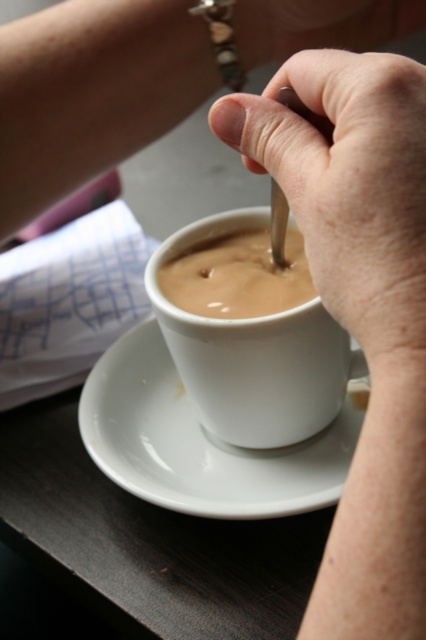
Question: Which of the following is the farthest from the observer?

Choices:
 (A) (331, 442)
 (B) (368, 349)

Answer: (A)

Question: From the image, what is the correct spatial relationship of white matte cup at center in relation to matte ceramic cup at center?

Choices:
 (A) right
 (B) left

Answer: (A)

Question: Which of the following is the closest to the observer?

Choices:
 (A) (184, 298)
 (B) (109, 384)
 (C) (321, 147)
 (D) (261, 387)

Answer: (C)

Question: Based on their relative distances, which object is nearer to the matte ceramic cup at center?

Choices:
 (A) matte silver spoon at upper center
 (B) white matte cup at center

Answer: (B)

Question: Does matte silver spoon at upper center have a lesser width compared to white matte cup at center?

Choices:
 (A) no
 (B) yes

Answer: (B)

Question: Is matte silver spoon at upper center above matte ceramic cup at center?

Choices:
 (A) yes
 (B) no

Answer: (A)